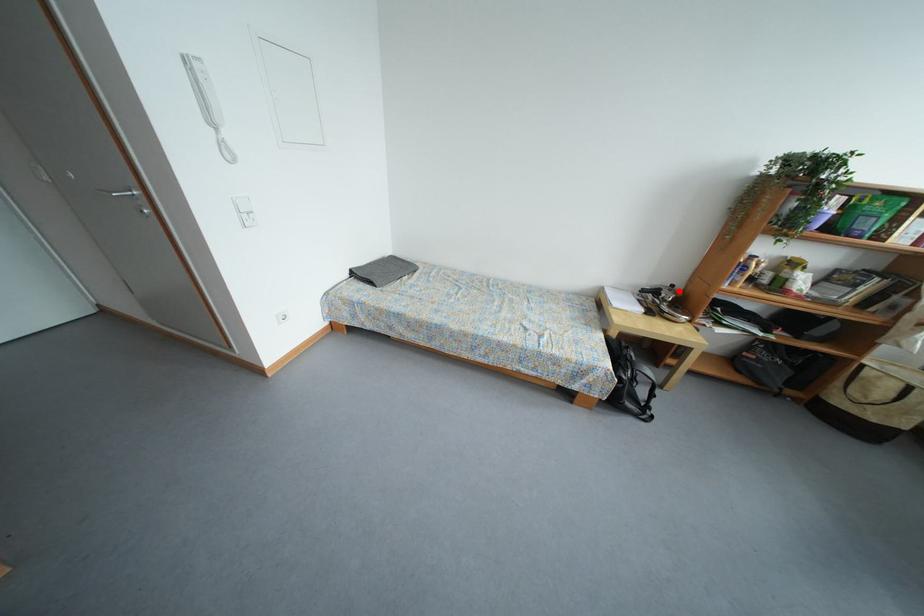
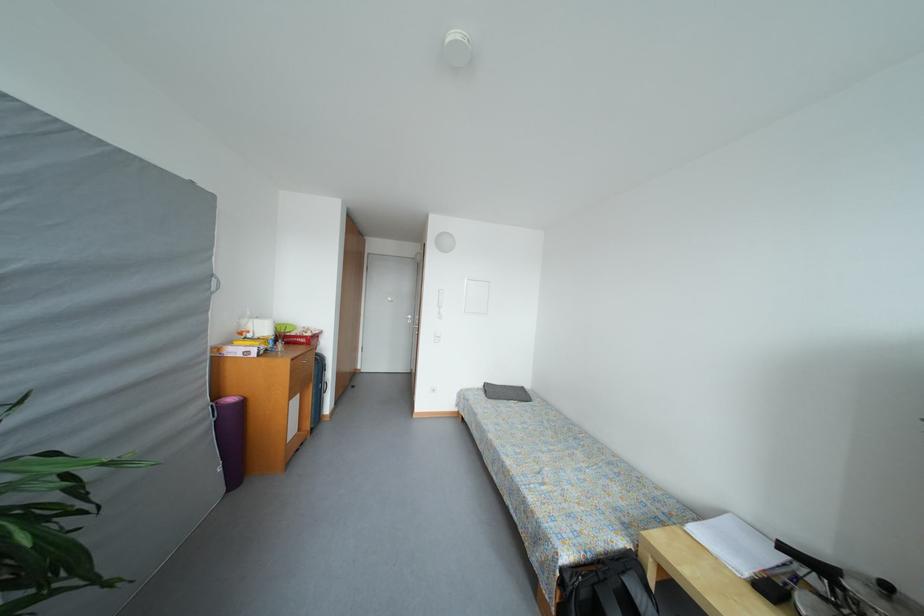
Locate, in the second image, the point that corresponds to the highlighted location in the first image.

(893, 591)